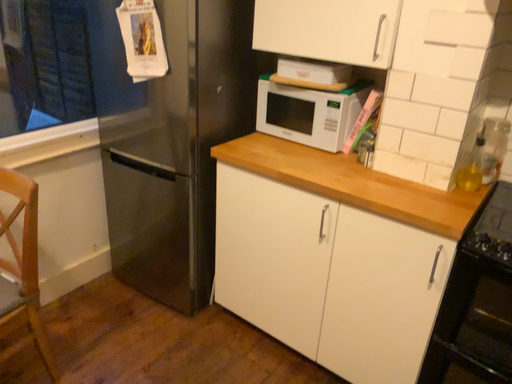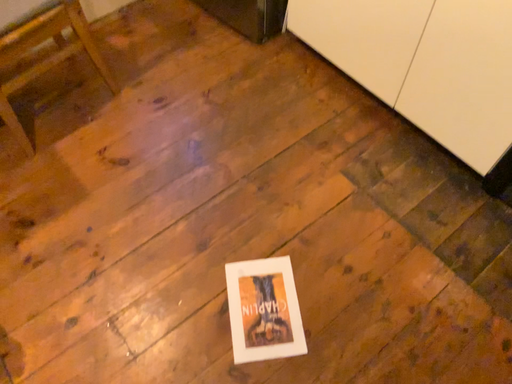
Question: Which way did the camera rotate in the video?

Choices:
 (A) rotated upward
 (B) rotated downward

Answer: (B)